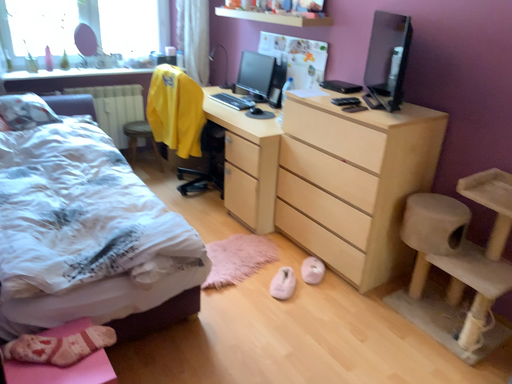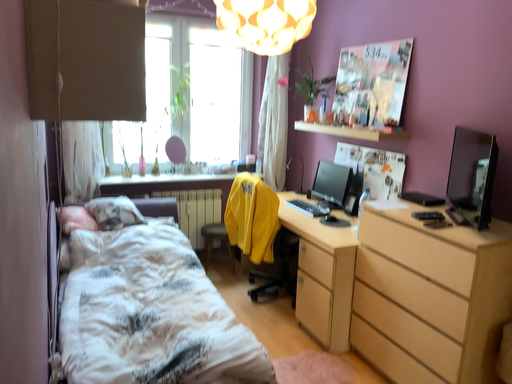
Question: How did the camera likely rotate when shooting the video?

Choices:
 (A) rotated right
 (B) rotated left

Answer: (B)